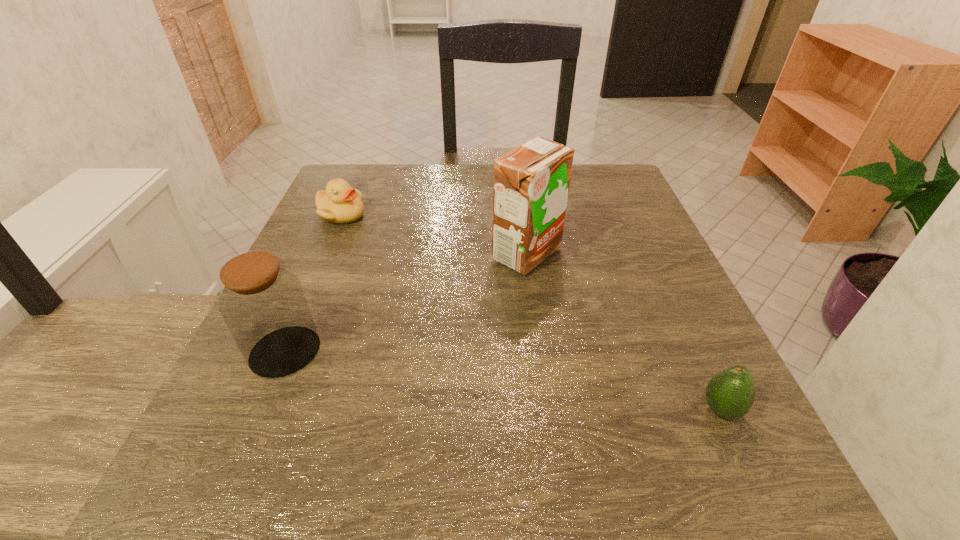
Find the location of a particular element. This screenshot has width=960, height=540. the tallest object is located at coordinates (531, 183).

Identify the location of the third nearest object. The width and height of the screenshot is (960, 540). (531, 183).

Image resolution: width=960 pixels, height=540 pixels. Find the location of `the second tallest object`. the second tallest object is located at coordinates (263, 304).

The image size is (960, 540). I want to click on the second nearest object, so click(x=263, y=304).

Locate an element on the screen. the farthest object is located at coordinates (340, 203).

In order to click on avocado in this screenshot , I will do `click(730, 393)`.

The height and width of the screenshot is (540, 960). Find the location of `the rightmost object`. the rightmost object is located at coordinates (730, 393).

The image size is (960, 540). What are the coordinates of `vacant space located 0.230m on the straw side of the second object from right to left` in the screenshot? It's located at (379, 254).

The width and height of the screenshot is (960, 540). Find the location of `vacant space situated 0.210m on the straw side of the second object from right to left`. vacant space situated 0.210m on the straw side of the second object from right to left is located at coordinates (389, 254).

Image resolution: width=960 pixels, height=540 pixels. Find the location of `free space located 0.300m on the straw side of the second object from right to left`. free space located 0.300m on the straw side of the second object from right to left is located at coordinates (345, 254).